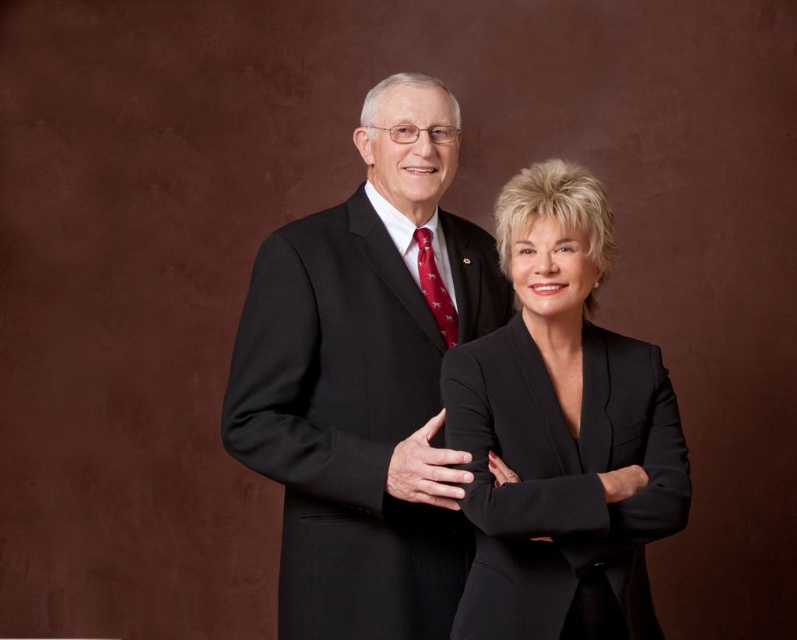
You are a photographer adjusting your camera settings to focus on the two people in the image. Which of the two suits, the matte black suit at center or the black matte suit at center, should you focus on first to ensure proper depth of field?

The matte black suit at center is further to the viewer than the black matte suit at center, so you should focus on the matte black suit at center first to ensure proper depth of field.

You are a fashion designer analyzing two suits in a photo. You see the matte black suit at center and the black matte suit at center. Which one appears bigger?

The matte black suit at center has a larger size compared to the black matte suit at center.

You are a photographer setting up a photo shoot with two people wearing the same type of formal attire. You notice the matte black suit at center and the black matte suit at center. Which one is taller?

The matte black suit at center is much taller than the black matte suit at center.